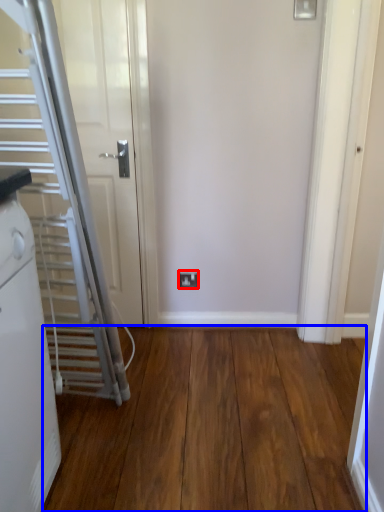
Question: Which point is closer to the camera, electric outlet (highlighted by a red box) or corridor (highlighted by a blue box)?

Choices:
 (A) electric outlet
 (B) corridor

Answer: (B)